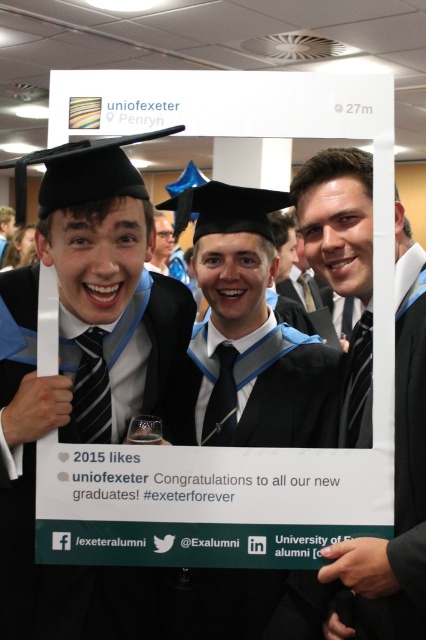
Question: Among these points, which one is nearest to the camera?

Choices:
 (A) (43, 227)
 (B) (400, 212)

Answer: (A)

Question: Which object appears farthest from the camera in this image?

Choices:
 (A) matte black graduation cap at left
 (B) matte black suit at center

Answer: (B)

Question: Can you confirm if matte black graduation cap at left is smaller than matte black suit at center?

Choices:
 (A) yes
 (B) no

Answer: (B)

Question: Does matte black graduation cap at left have a larger size compared to matte black suit at center?

Choices:
 (A) yes
 (B) no

Answer: (A)

Question: Considering the relative positions of matte black graduation cap at left and matte black suit at center in the image provided, where is matte black graduation cap at left located with respect to matte black suit at center?

Choices:
 (A) left
 (B) right

Answer: (A)